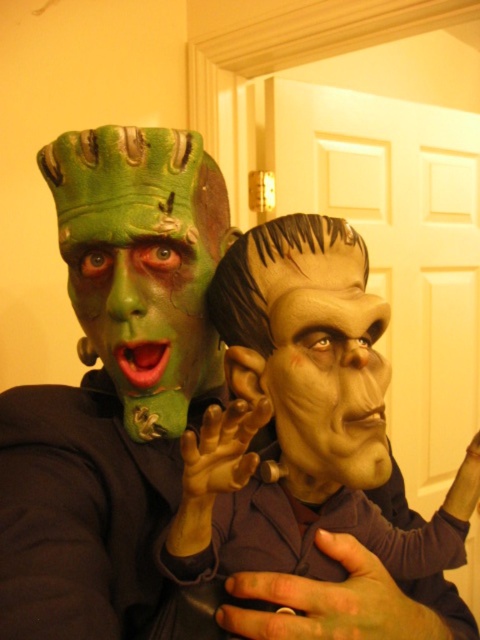
You are a costume designer trying to arrange two green matte Frankenstein masks for a display. The masks are the green matte frankenstein mask at left and the green matte frankenstein mask at center. You need to place them on a shelf that is 10 inches wide. Can both masks fit side by side without overlapping?

The green matte frankenstein mask at left is 5.81 inches from the green matte frankenstein mask at center, so the total space required between them would be at least 5.81 inches. Since the shelf is 10 inches wide, there is enough space to place both masks side by side without overlapping.

You are a photographer standing at a distance. You want to take a closeup shot of the green matte frankenstein mask at left without moving closer. Can you do that with a standard camera lens that has a minimum focusing distance of 50 centimeters?

The green matte frankenstein mask at left is 61.06 centimeters away from viewer. Since the minimum focusing distance is 50 centimeters, the photographer can take a closeup shot without moving closer because the mask is within the lens range.

You are a photographer taking a picture of the scene. The green matte frankenstein mask at left is at point 0.475, 0.308. Where should you focus your camera to ensure the mask is in sharp focus?

You should focus your camera at point [147,304] to ensure the green matte frankenstein mask at left is in sharp focus.